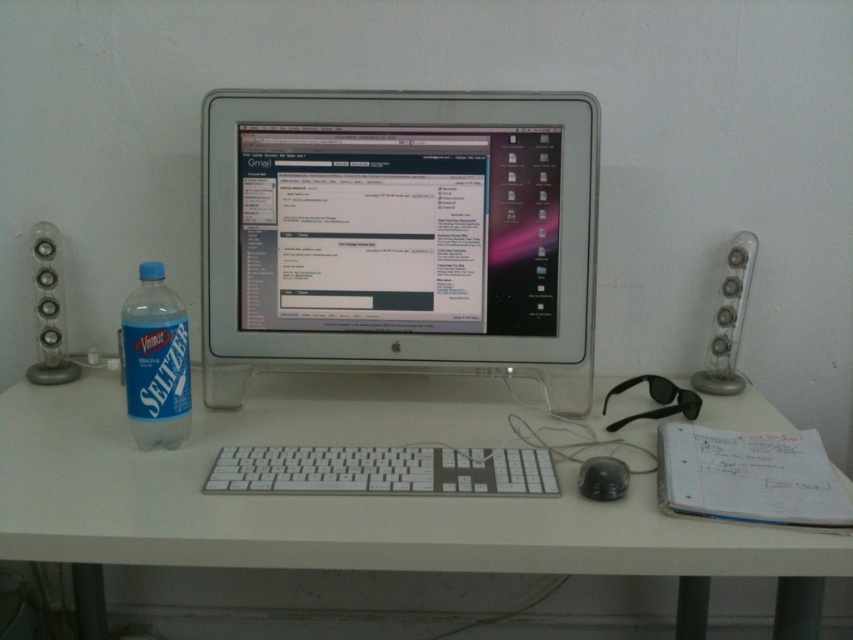
You are standing at the edge of the desk in the workspace scene. You want to reach the point marked at coordinates (753, 253). Considering your arm can extend 4 feet, can you comfortably reach that point without moving your body?

The point at coordinates (753, 253) is 4.61 feet away from the viewer. Since your arm can only extend 4 feet, you cannot comfortably reach that point without moving your body.

You are setting up a new webcam for video calls. The webcam needs to be placed directly above the sleek silver monitor at center to ensure the best angle. According to the coordinates provided, where should you position the webcam?

The sleek silver monitor at center is located at point (399, 234), so you should position the webcam directly above this coordinate to achieve the optimal placement for video calls.

You are setting up a new monitor and want to place it on the white plastic computer desk at center. However, you notice the sleek silver monitor at center is already there. Can you place your new monitor on the desk without moving the existing one?

The white plastic computer desk at center is behind the sleek silver monitor at center, meaning the desk is positioned behind the existing monitor. Therefore, there is space on the desk in front of the sleek silver monitor at center where you can place your new monitor without moving it.